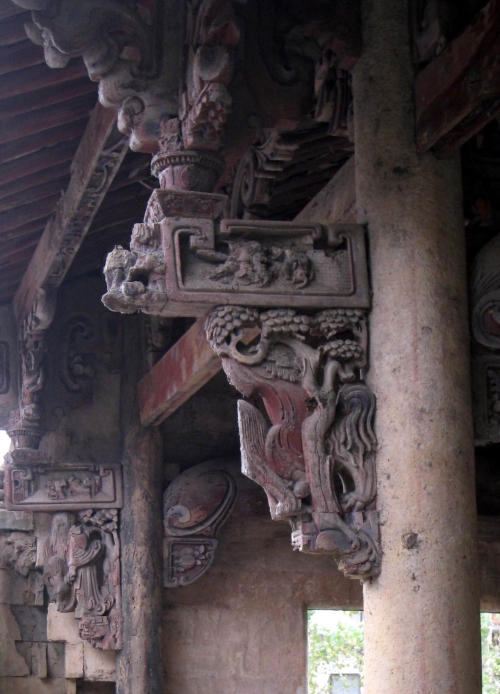
This screenshot has width=500, height=694. I want to click on sconce, so click(x=362, y=286), click(x=181, y=75), click(x=121, y=554).